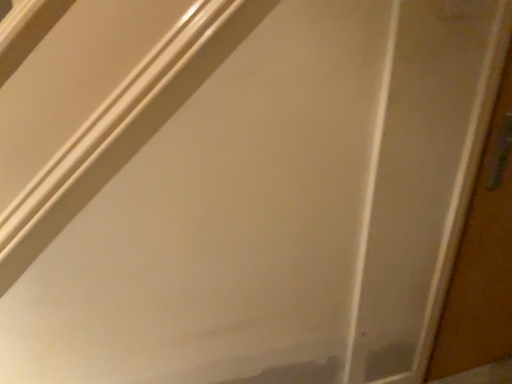
This screenshot has height=384, width=512. Describe the element at coordinates (482, 258) in the screenshot. I see `wooden door at right` at that location.

Where is `wooden door at right`? This screenshot has width=512, height=384. wooden door at right is located at coordinates (482, 258).

Image resolution: width=512 pixels, height=384 pixels. In order to click on wooden door at right in this screenshot , I will do `click(482, 258)`.